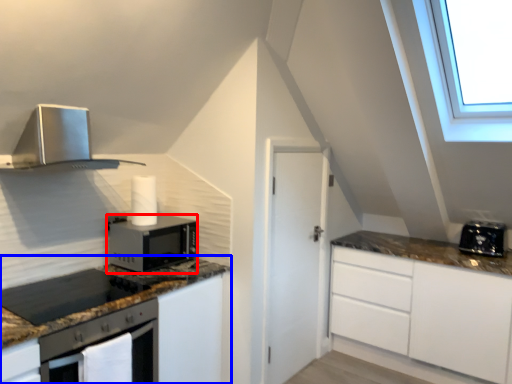
Question: Which of the following is the closest to the observer, microwave oven (highlighted by a red box) or cabinetry (highlighted by a blue box)?

Choices:
 (A) microwave oven
 (B) cabinetry

Answer: (B)